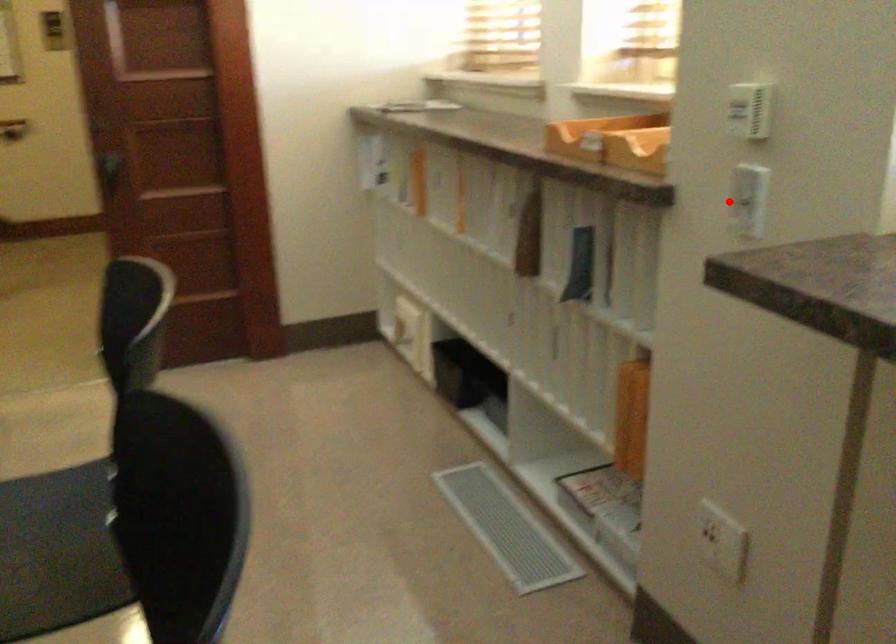
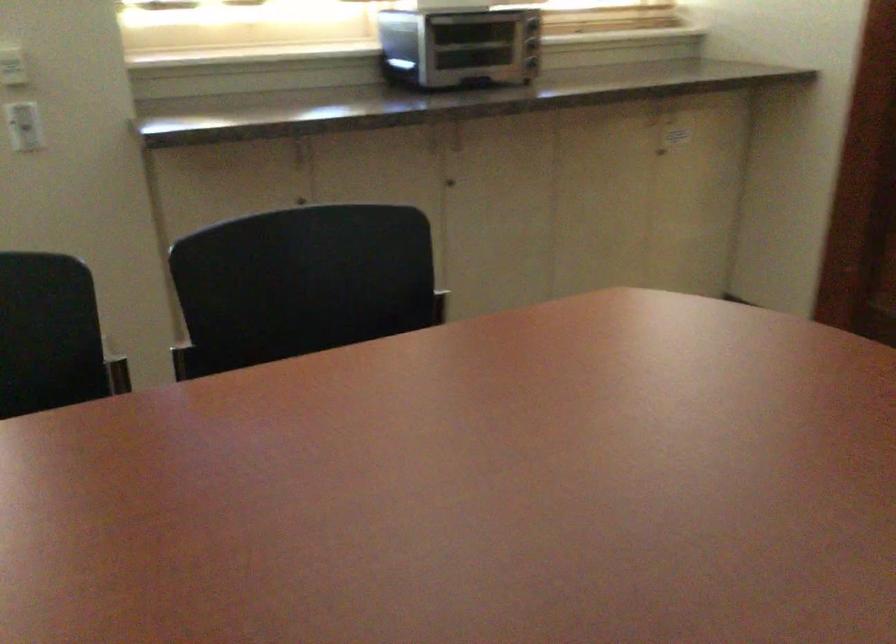
In the second image, find the point that corresponds to the highlighted location in the first image.

(24, 126)